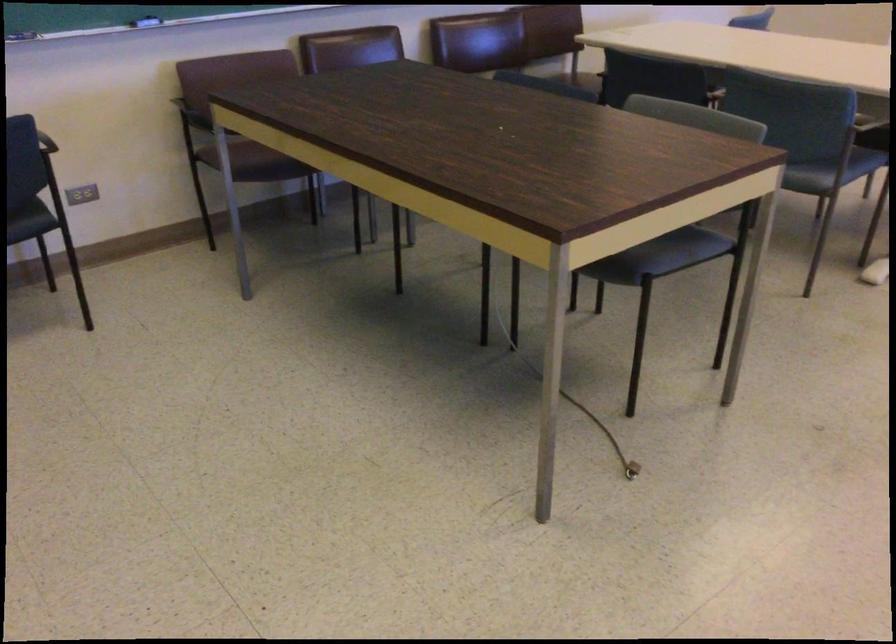
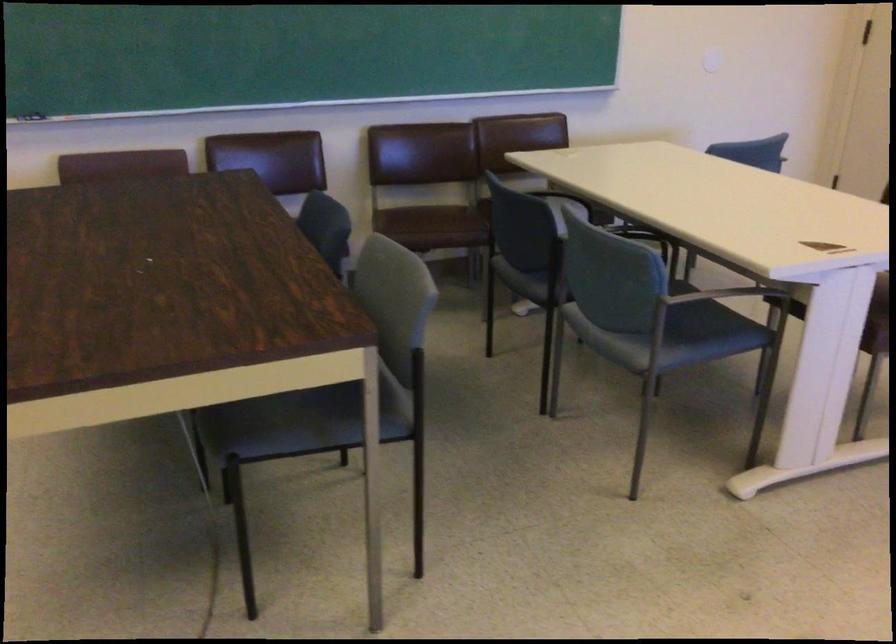
Which direction would the cameraman need to move to produce the second image?

The cameraman moved toward right, forward.